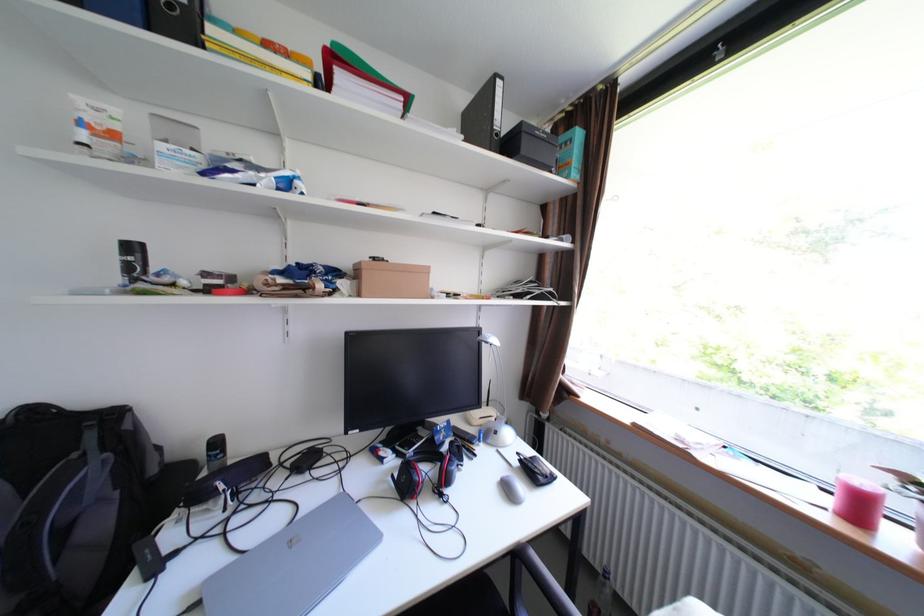
This screenshot has width=924, height=616. What do you see at coordinates (530, 146) in the screenshot?
I see `a black box` at bounding box center [530, 146].